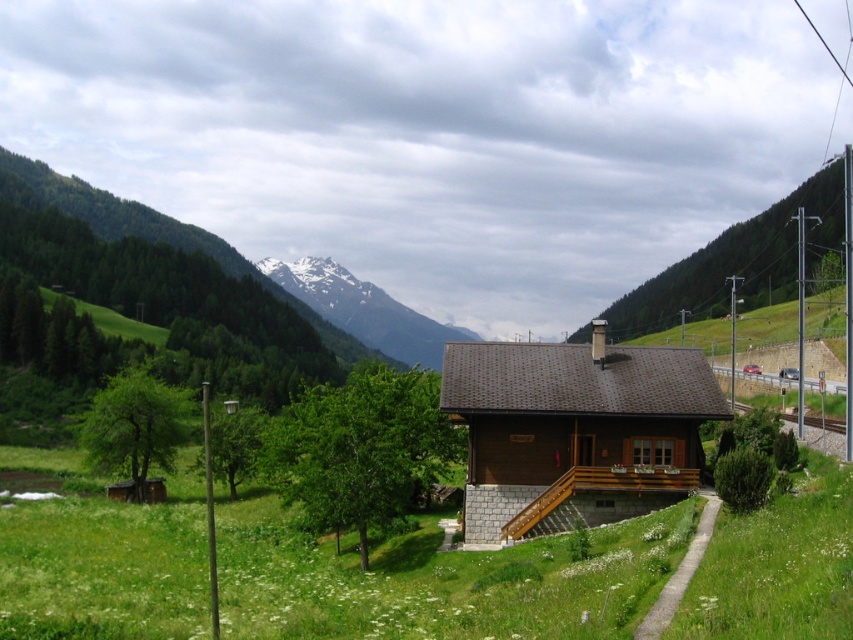
Is point (323, 621) farther from camera compared to point (759, 404)?

No, (323, 621) is closer to viewer.

Where is `green grassy at lower center`? The width and height of the screenshot is (853, 640). green grassy at lower center is located at coordinates (437, 582).

Which is in front, point (248, 589) or point (775, 410)?

Positioned in front is point (248, 589).

Image resolution: width=853 pixels, height=640 pixels. Find the location of `green grassy at lower center`. green grassy at lower center is located at coordinates (437, 582).

Between snowy rock mountain at upper center and metal/smooth train track at lower right, which one is positioned higher?

snowy rock mountain at upper center

Who is more forward, (368, 292) or (776, 404)?

Point (776, 404) is in front.

Where is `snowy rock mountain at upper center`? snowy rock mountain at upper center is located at coordinates (363, 308).

Is green grassy at lower center below snowy rock mountain at upper center?

Yes, green grassy at lower center is below snowy rock mountain at upper center.

Who is higher up, green grassy at lower center or snowy rock mountain at upper center?

snowy rock mountain at upper center is higher up.

Is point (74, 604) closer to viewer compared to point (434, 358)?

Yes, it is in front of point (434, 358).

You are a GUI agent. You are given a task and a screenshot of the screen. Output one action in this format:
    pyautogui.click(x=<x>, y=<y>)
    Task: Click on the green grassy at lower center
    
    Given the screenshot: What is the action you would take?
    pyautogui.click(x=437, y=582)